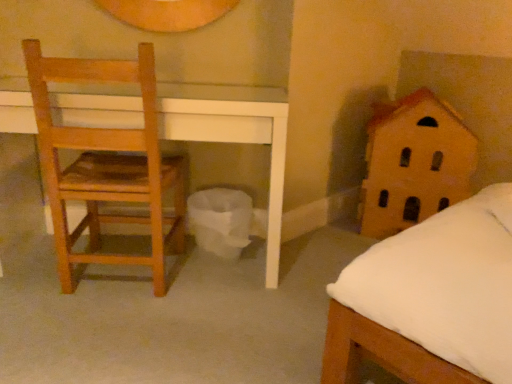
Question: Is wooden house at right not close to wooden chair at left?

Choices:
 (A) no
 (B) yes

Answer: (B)

Question: Does wooden house at right have a greater height compared to wooden chair at left?

Choices:
 (A) no
 (B) yes

Answer: (A)

Question: From a real-world perspective, is wooden house at right located beneath wooden chair at left?

Choices:
 (A) no
 (B) yes

Answer: (B)

Question: Is wooden house at right smaller than wooden chair at left?

Choices:
 (A) no
 (B) yes

Answer: (A)

Question: Can you confirm if wooden house at right is positioned to the right of wooden chair at left?

Choices:
 (A) no
 (B) yes

Answer: (B)

Question: Is wooden house at right positioned with its back to wooden chair at left?

Choices:
 (A) yes
 (B) no

Answer: (B)

Question: From a real-world perspective, is wooden chair at left located higher than wooden house at right?

Choices:
 (A) yes
 (B) no

Answer: (A)

Question: Is wooden house at right located within wooden chair at left?

Choices:
 (A) no
 (B) yes

Answer: (A)

Question: Is wooden chair at left positioned in front of wooden house at right?

Choices:
 (A) yes
 (B) no

Answer: (A)

Question: Is wooden chair at left wider than wooden house at right?

Choices:
 (A) yes
 (B) no

Answer: (B)

Question: Can we say wooden chair at left lies outside wooden house at right?

Choices:
 (A) no
 (B) yes

Answer: (B)

Question: From the image's perspective, would you say wooden chair at left is shown under wooden house at right?

Choices:
 (A) yes
 (B) no

Answer: (A)

Question: In the image, is wooden house at right on the left side or the right side of wooden chair at left?

Choices:
 (A) left
 (B) right

Answer: (B)